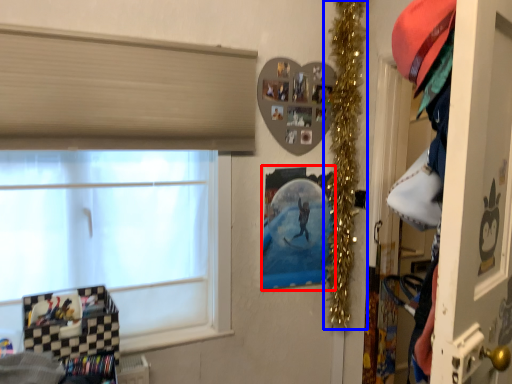
Question: Which point is closer to the camera, picture frame (highlighted by a red box) or christmas decoration (highlighted by a blue box)?

Choices:
 (A) picture frame
 (B) christmas decoration

Answer: (B)